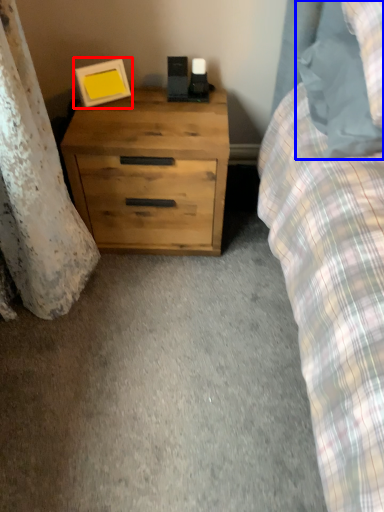
Question: Among these objects, which one is farthest to the camera, picture frame (highlighted by a red box) or pillow (highlighted by a blue box)?

Choices:
 (A) picture frame
 (B) pillow

Answer: (A)